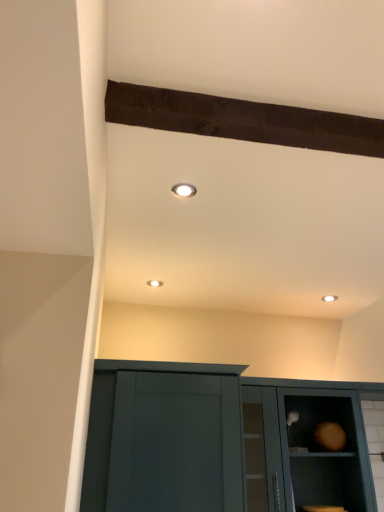
Question: Is matte teal cabinet at lower right smaller than matte dark green cabinet door at lower center?

Choices:
 (A) yes
 (B) no

Answer: (A)

Question: Does matte teal cabinet at lower right have a greater height compared to matte dark green cabinet door at lower center?

Choices:
 (A) yes
 (B) no

Answer: (B)

Question: From the image's perspective, is matte teal cabinet at lower right under matte dark green cabinet door at lower center?

Choices:
 (A) yes
 (B) no

Answer: (A)

Question: Does matte teal cabinet at lower right lie in front of matte dark green cabinet door at lower center?

Choices:
 (A) no
 (B) yes

Answer: (A)

Question: Does matte teal cabinet at lower right have a greater width compared to matte dark green cabinet door at lower center?

Choices:
 (A) yes
 (B) no

Answer: (B)

Question: Is matte teal cabinet at lower right thinner than matte dark green cabinet door at lower center?

Choices:
 (A) no
 (B) yes

Answer: (B)

Question: Is matte white recessed light at upper center looking in the opposite direction of matte dark green cabinet door at lower center?

Choices:
 (A) yes
 (B) no

Answer: (B)

Question: Does matte white recessed light at upper center appear on the right side of matte dark green cabinet door at lower center?

Choices:
 (A) no
 (B) yes

Answer: (B)

Question: Considering the relative sizes of matte white recessed light at upper center and matte dark green cabinet door at lower center in the image provided, is matte white recessed light at upper center bigger than matte dark green cabinet door at lower center?

Choices:
 (A) no
 (B) yes

Answer: (A)

Question: Are matte white recessed light at upper center and matte dark green cabinet door at lower center making contact?

Choices:
 (A) yes
 (B) no

Answer: (B)

Question: Would you say matte white recessed light at upper center is a long distance from matte dark green cabinet door at lower center?

Choices:
 (A) no
 (B) yes

Answer: (B)

Question: Is the depth of matte white recessed light at upper center greater than that of matte dark green cabinet door at lower center?

Choices:
 (A) yes
 (B) no

Answer: (B)

Question: Is matte dark green cabinet door at lower center smaller than matte teal cabinet at lower right?

Choices:
 (A) no
 (B) yes

Answer: (A)